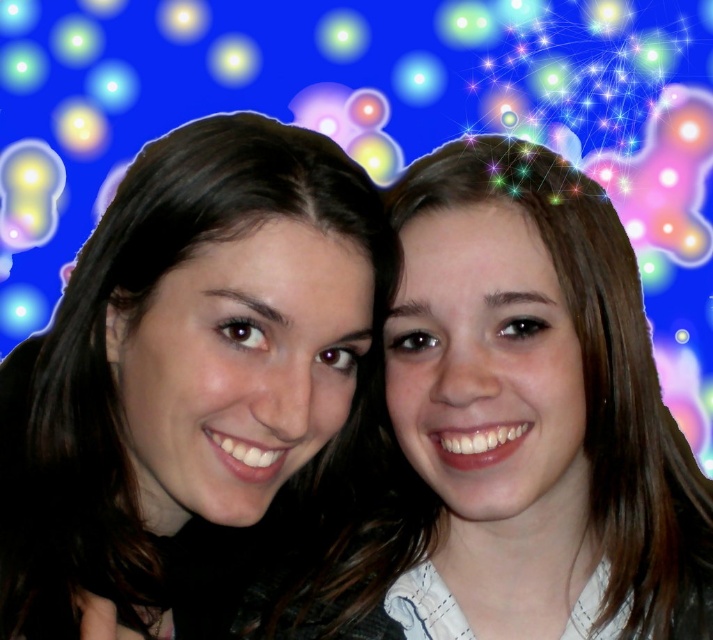
Is smooth skin face at center closer to camera compared to smooth skin face at right?

No, smooth skin face at center is further to the viewer.

Based on the photo, who is more distant from viewer, [4,365] or [483,563]?

The point [4,365] is more distant.

Where is `smooth skin face at center`? The height and width of the screenshot is (640, 713). smooth skin face at center is located at coordinates (190, 380).